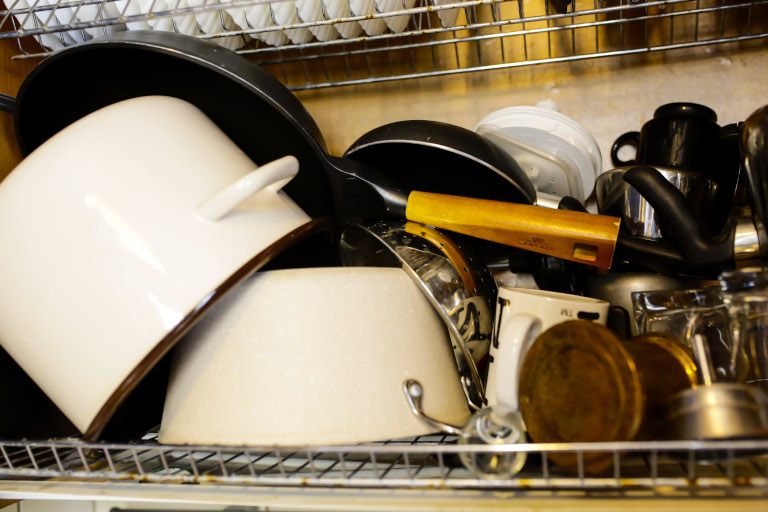
In order to click on pot in this screenshot , I will do `click(177, 196)`.